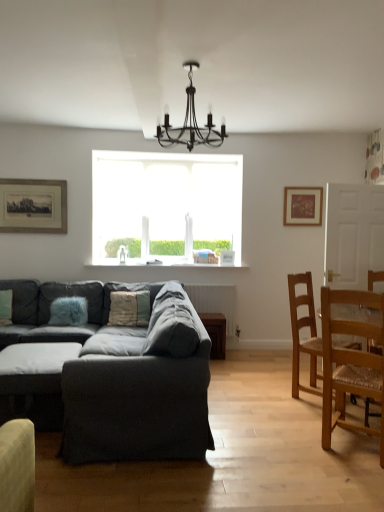
What are the coordinates of `vacant space situated above dark gray fabric ottoman at lower left (from a real-world perspective)` in the screenshot? It's located at pos(29,356).